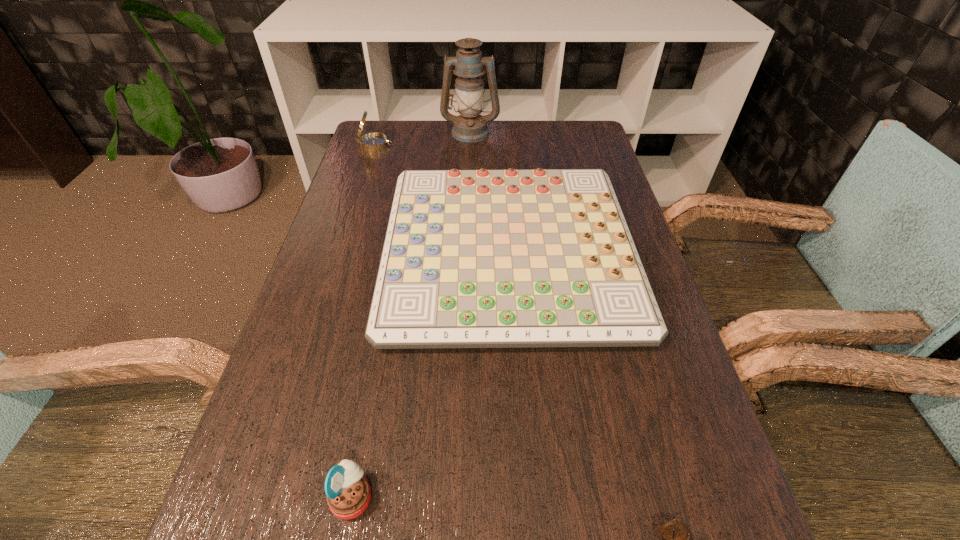
The image size is (960, 540). Identify the location of the tallest object. (470, 126).

The height and width of the screenshot is (540, 960). In order to click on the left compass in this screenshot , I will do `click(374, 141)`.

Image resolution: width=960 pixels, height=540 pixels. I want to click on the taller compass, so click(x=374, y=141).

You are a GUI agent. You are given a task and a screenshot of the screen. Output one action in this format:
    pyautogui.click(x=<x>, y=<y>)
    Task: Click on the fourth farthest object
    Image resolution: width=960 pixels, height=540 pixels.
    Given the screenshot: What is the action you would take?
    pyautogui.click(x=348, y=493)

Find the location of a particular element. the fourth tallest object is located at coordinates (516, 258).

Locate an element on the screen. The width and height of the screenshot is (960, 540). gameboard is located at coordinates (516, 258).

Identify the location of vacant space located 0.090m on the front of the oil lamp. (469, 158).

Locate an element on the screen. free space located with the dial facing the leftmost object is located at coordinates (452, 145).

The image size is (960, 540). What are the coordinates of `free point located 0.320m on the front-facing side of the second nearest object` in the screenshot? It's located at (583, 497).

Where is `free space located on the back of the gameboard`? The image size is (960, 540). free space located on the back of the gameboard is located at coordinates (502, 154).